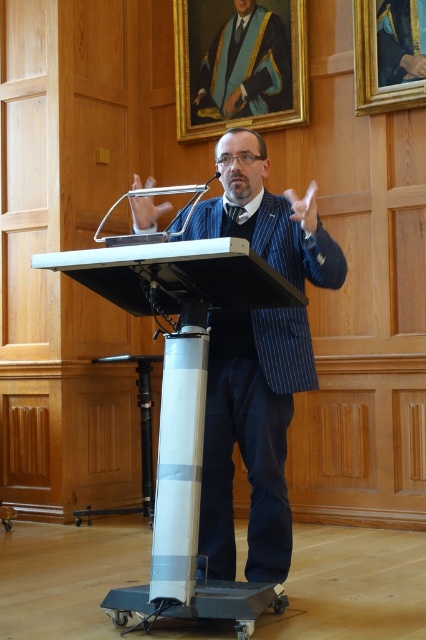
You are an attendee at this event and want to approach the lectern to ask a question. The lectern is at the center of the room. There is a point marked at coordinates (x=181, y=404). Where is this point located in relation to the lectern?

The point at coordinates (x=181, y=404) is located on the white plastic podium at center, which is the lectern itself.

You are an event planner setting up a stage for a keynote speech. The stage has the white plastic podium at center and the matte gold and blue academic gown at upper center. You need to ensure there is enough space between them for a 10 feet long banner. Is the current distance sufficient?

The white plastic podium at center and matte gold and blue academic gown at upper center are 10.58 feet apart, which is more than the required 10 feet for the banner. Therefore, the current distance is sufficient.